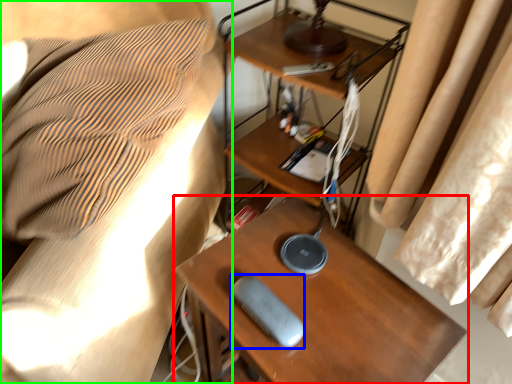
Question: Estimate the real-world distances between objects in this image. Which object is farther from table (highlighted by a red box), equipment (highlighted by a blue box) or furniture (highlighted by a green box)?

Choices:
 (A) equipment
 (B) furniture

Answer: (B)